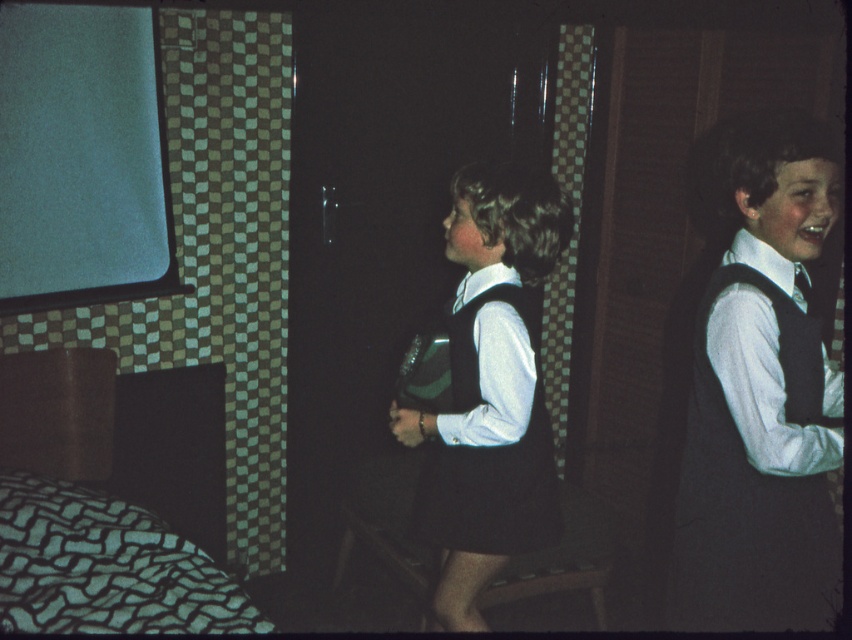
Question: Is matte black vest at right thinner than silky black tie at right?

Choices:
 (A) no
 (B) yes

Answer: (A)

Question: Which point appears farthest from the camera in this image?

Choices:
 (A) (674, 512)
 (B) (797, 280)
 (C) (499, 449)

Answer: (C)

Question: Does matte black vest at right lie in front of white matte dress at center?

Choices:
 (A) no
 (B) yes

Answer: (B)

Question: Among these objects, which one is farthest from the camera?

Choices:
 (A) green textured fabric bed at lower left
 (B) matte black vest at right

Answer: (A)

Question: Which point is closer to the camera?

Choices:
 (A) green textured fabric bed at lower left
 (B) silky black tie at right
 (C) matte black vest at right
 (D) white matte dress at center

Answer: (C)

Question: Is green textured fabric bed at lower left below silky black tie at right?

Choices:
 (A) no
 (B) yes

Answer: (B)